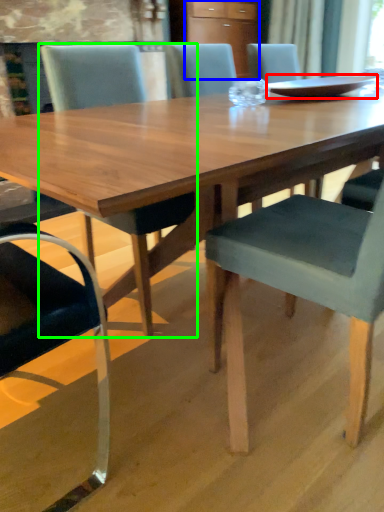
Question: Based on their relative distances, which object is nearer to tray (highlighted by a red box)? Choose from cabinetry (highlighted by a blue box) and chair (highlighted by a green box).

Choices:
 (A) cabinetry
 (B) chair

Answer: (B)